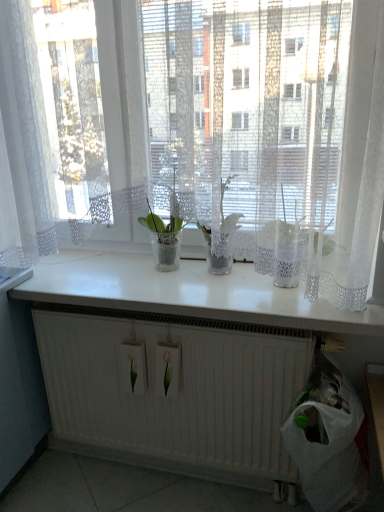
At what (x,y) coordinates should I click in order to perform the action: click on free spot below white matte radiator at lower center (from a real-world perspective). Please return your answer as a coordinate pair (x, y). This screenshot has height=512, width=384. Looking at the image, I should click on 176,479.